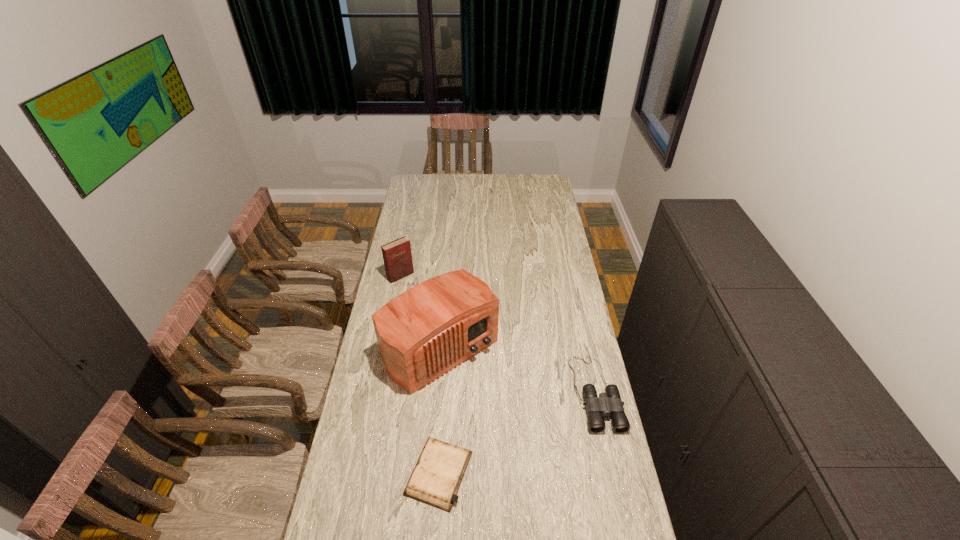
You are a GUI agent. You are given a task and a screenshot of the screen. Output one action in this format:
    pyautogui.click(x=<x>, y=<y>)
    Task: Click on the free region at the near edge of the desktop
    Image resolution: width=960 pixels, height=540 pixels.
    Given the screenshot: What is the action you would take?
    pyautogui.click(x=418, y=508)

You are a GUI agent. You are given a task and a screenshot of the screen. Output one action in this format:
    pyautogui.click(x=<x>, y=<y>)
    Task: Click on the vacant space at the left edge
    This screenshot has width=960, height=540.
    Given the screenshot: What is the action you would take?
    pyautogui.click(x=378, y=453)

In order to click on vacant space at the right edge of the desktop in this screenshot , I will do `click(555, 286)`.

The image size is (960, 540). I want to click on free location at the far left corner of the desktop, so click(434, 174).

This screenshot has height=540, width=960. Find the location of `free space between the farthest object and the rightmost object`. free space between the farthest object and the rightmost object is located at coordinates (498, 334).

Image resolution: width=960 pixels, height=540 pixels. Identify the location of free space between the radio receiver and the right diary. (440, 411).

This screenshot has width=960, height=540. I want to click on free space between the rightmost object and the tallest object, so click(x=518, y=370).

The width and height of the screenshot is (960, 540). In order to click on blank region between the second shortest object and the left diary in this screenshot , I will do `click(498, 334)`.

The image size is (960, 540). In order to click on unoccupied area between the farther diary and the rightmost object in this screenshot , I will do `click(498, 334)`.

At what (x,y) coordinates should I click in order to perform the action: click on free point between the third tallest object and the right diary. Please return your answer as a coordinate pair (x, y). Looking at the image, I should click on (517, 433).